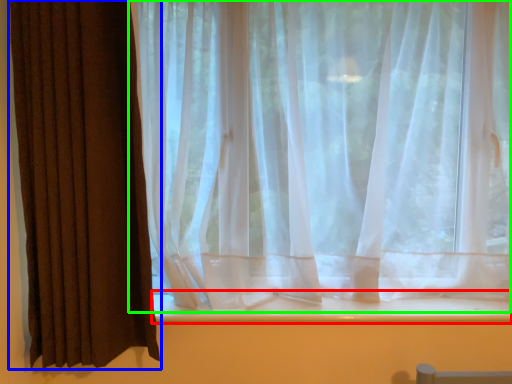
Question: Estimate the real-world distances between objects in this image. Which object is farther from window sill (highlighted by a red box), curtain (highlighted by a blue box) or curtain (highlighted by a green box)?

Choices:
 (A) curtain
 (B) curtain

Answer: (A)